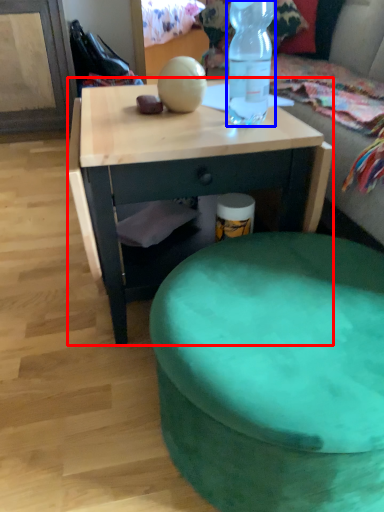
Question: Which point is further to the camera, desk (highlighted by a red box) or bottle (highlighted by a blue box)?

Choices:
 (A) desk
 (B) bottle

Answer: (A)